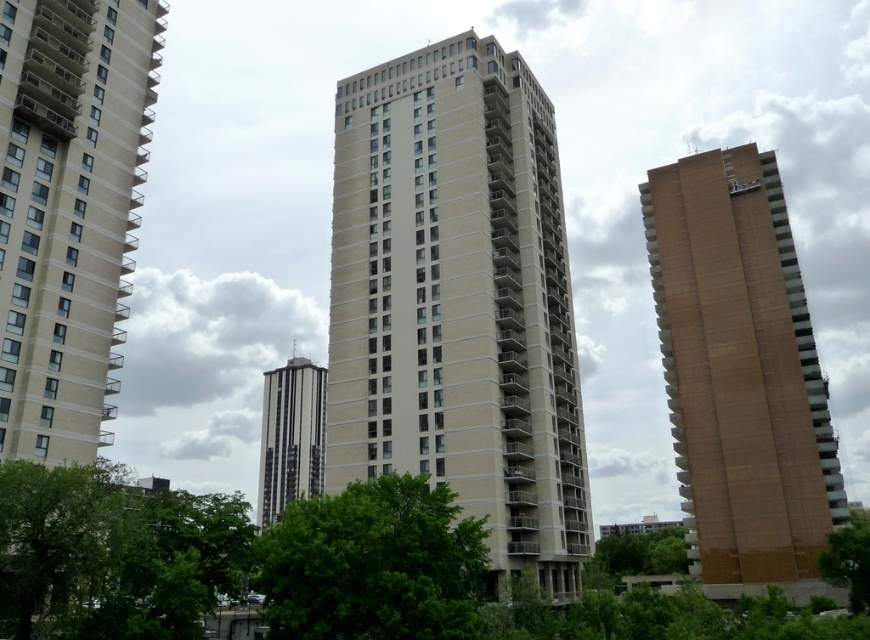
You are standing in the city looking at the beige concrete building at center and the beige concrete building at left. Which building appears closer to you?

The beige concrete building at center appears closer because it is positioned further to the viewer than the beige concrete building at left.

You are standing at the center of the cityscape and want to take a photo of the brown concrete building at right. Given its coordinates at point 0.578, 0.852, will it appear in the upper half of your camera frame?

The brown concrete building at right is located at point (740, 369). Since the y coordinate 0.852 is above 0.5, it will appear in the upper half of the camera frame.